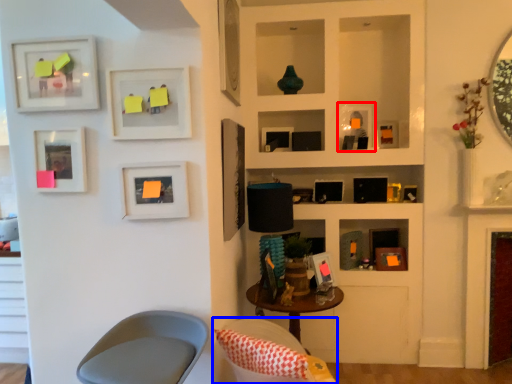
Question: Which point is closer to the camera, picture frame (highlighted by a red box) or chair (highlighted by a blue box)?

Choices:
 (A) picture frame
 (B) chair

Answer: (B)